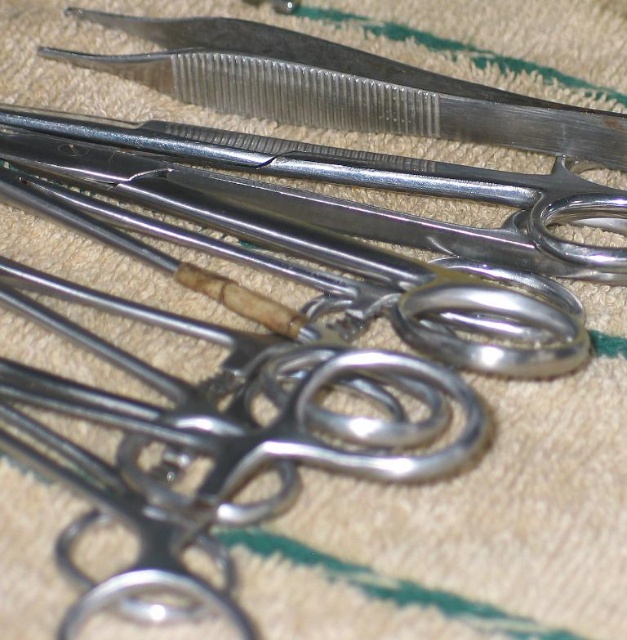
You are a medical student observing a surgical tray. The tray has a green stripe patterned cloth. You need to locate the polished metal scissors at center. Where exactly are they positioned on the tray?

The polished metal scissors at center are positioned at point coordinates of 0.291 on the x axis and 0.571 on the y axis.

In the scene shown: You are a surgeon preparing to sterilize instruments. You have two points marked on the tray where instruments are placed. The points are labeled as point (223, 177) and point (231, 112). Which point is closer to you when you look at the tray?

Point (223, 177) is closer to the viewer than point (231, 112).